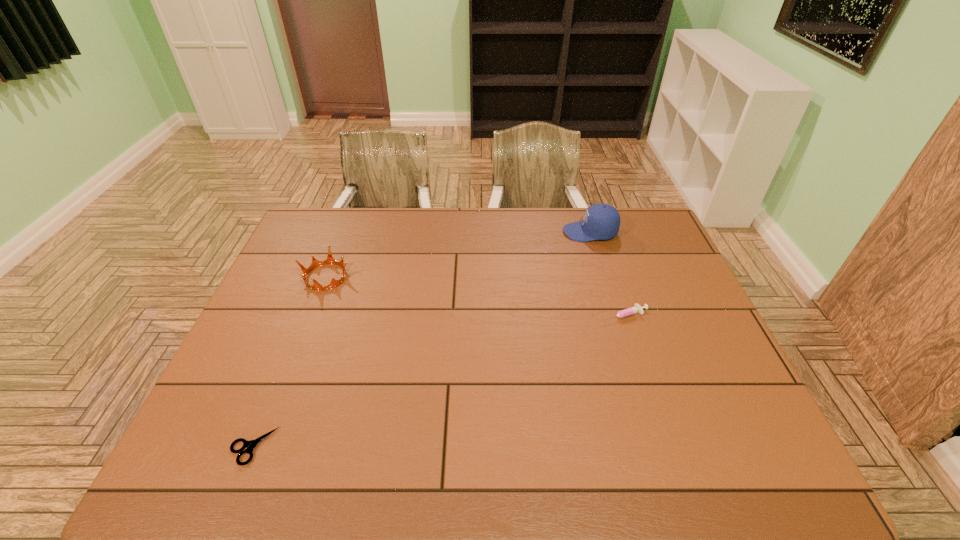
In order to click on object at the near left corner in this screenshot , I will do `click(250, 445)`.

Locate an element on the screen. Image resolution: width=960 pixels, height=540 pixels. object located at the far right corner is located at coordinates (601, 221).

You are a GUI agent. You are given a task and a screenshot of the screen. Output one action in this format:
    pyautogui.click(x=<x>, y=<y>)
    Task: Click on the vacant position at the far edge of the desktop
    This screenshot has height=540, width=960.
    Given the screenshot: What is the action you would take?
    pyautogui.click(x=432, y=223)

Identify the location of vacant space at the left edge. Image resolution: width=960 pixels, height=540 pixels. (273, 321).

Locate an element on the screen. free space at the right edge is located at coordinates (693, 381).

Where is `free space at the far left corner`? The height and width of the screenshot is (540, 960). free space at the far left corner is located at coordinates (332, 222).

Find the location of `vacant point located between the tallest object and the third nearest object`. vacant point located between the tallest object and the third nearest object is located at coordinates (458, 254).

The image size is (960, 540). Identify the location of vacant area between the cap and the third nearest object. (458, 254).

Where is `vacant space that's between the second nearest object and the shears`? vacant space that's between the second nearest object and the shears is located at coordinates (438, 381).

Locate an element on the screen. This screenshot has height=540, width=960. blank region between the shortest object and the second farthest object is located at coordinates (289, 362).